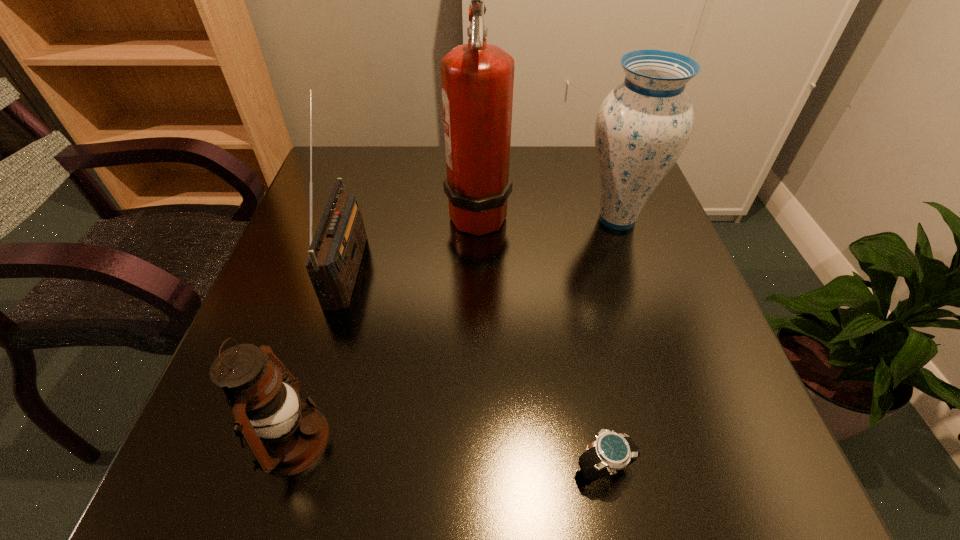
Identify the location of the tallest object. The image size is (960, 540). (477, 79).

Where is `the third object from right to left`? the third object from right to left is located at coordinates (477, 79).

Identify the location of the rightmost object. (643, 125).

Locate an element on the screen. radio receiver is located at coordinates (335, 252).

At what (x,y) coordinates should I click in order to perform the action: click on the fourth tallest object. Please return your answer as a coordinate pair (x, y). Looking at the image, I should click on (285, 435).

You are a GUI agent. You are given a task and a screenshot of the screen. Output one action in this format:
    pyautogui.click(x=<x>, y=<y>)
    Task: Click on the fourth object from left to right
    The width and height of the screenshot is (960, 540).
    Given the screenshot: What is the action you would take?
    pyautogui.click(x=610, y=452)

The width and height of the screenshot is (960, 540). In order to click on watch in this screenshot , I will do `click(610, 452)`.

Locate an element on the screen. vacant region located at the nozzle of the fire extinguisher is located at coordinates (552, 212).

This screenshot has height=540, width=960. Find the location of `vacant space located 0.080m on the back of the rightmost object`. vacant space located 0.080m on the back of the rightmost object is located at coordinates (603, 178).

Where is `free space located on the front-facing side of the radio receiver`? This screenshot has height=540, width=960. free space located on the front-facing side of the radio receiver is located at coordinates (395, 265).